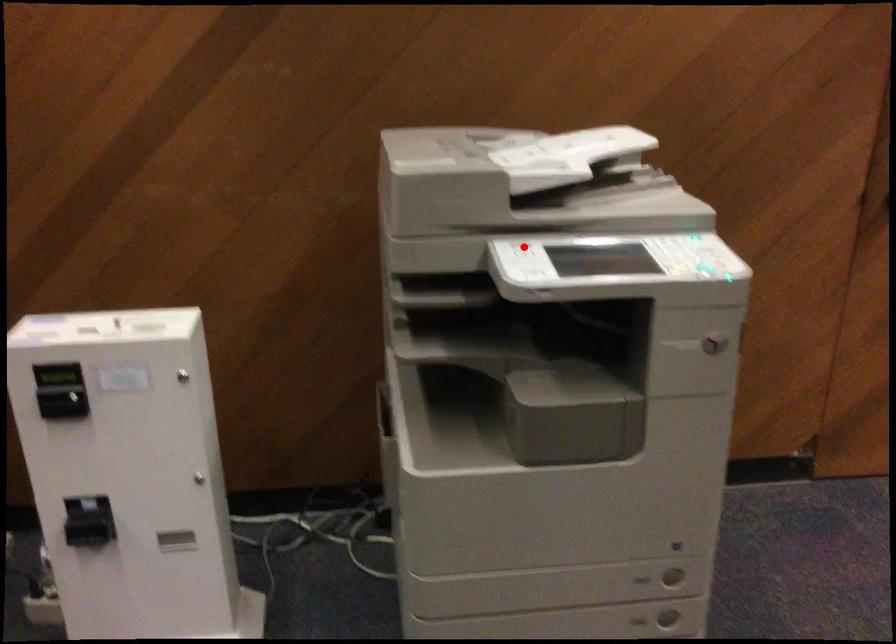
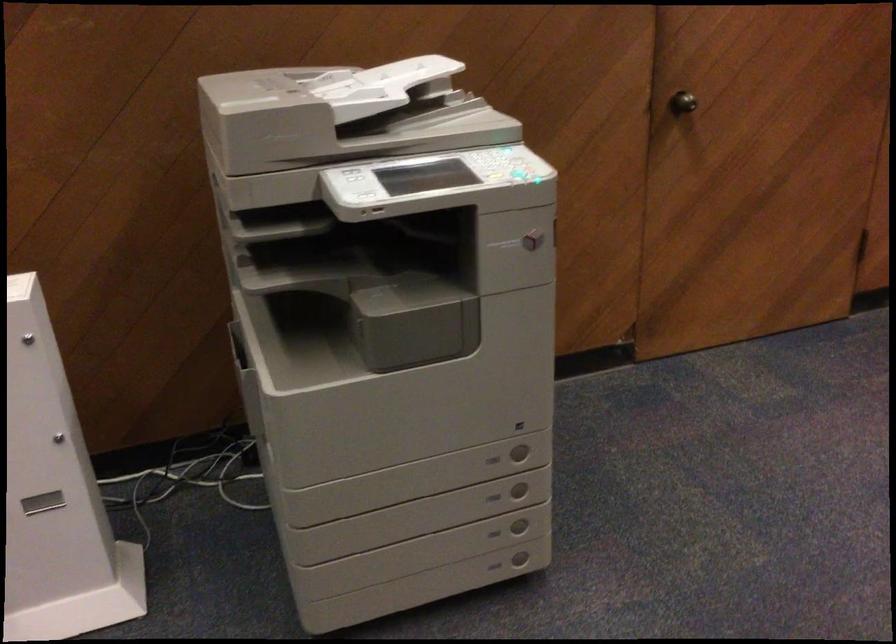
The point at the highlighted location is marked in the first image. Where is the corresponding point in the second image?

(354, 175)